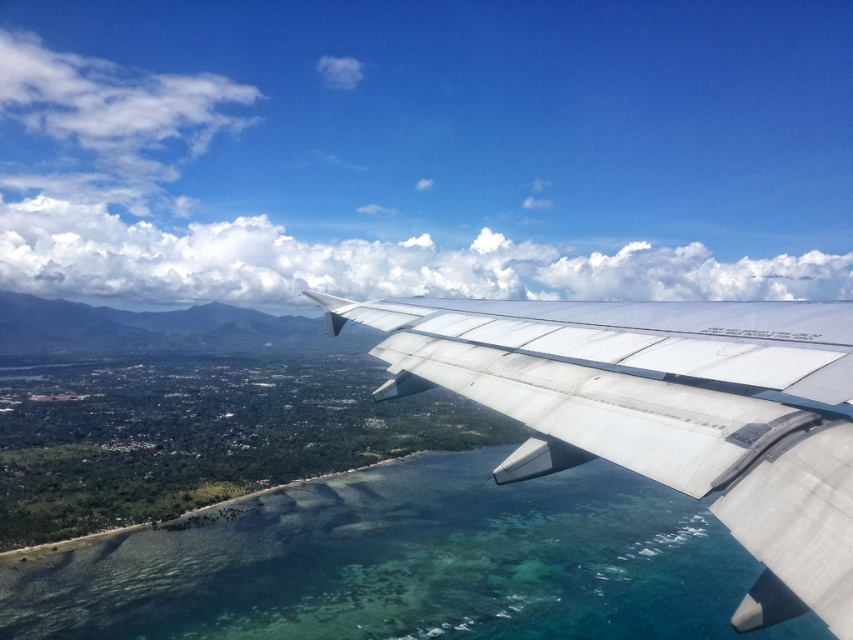
You are a pilot preparing for takeoff and need to ensure there are no obstacles between the silver metallic wing at center and the clear blue water at lower center. Given that the minimum safe distance for takeoff is 500 meters, is the current distance sufficient?

The distance between the silver metallic wing at center and the clear blue water at lower center is 551.03 meters, which exceeds the minimum safe distance of 500 meters. Therefore, the current distance is sufficient for takeoff.

You are a passenger on an airplane and looking out the window. You see the silver metallic wing at center and the clear blue water at lower center. Which object is closer to you?

The clear blue water at lower center is closer to you because the silver metallic wing at center is behind it.

Consider the image. You are a pilot preparing for landing and need to ensure the silver metallic wing at center doesn not obstruct your view of the clear blue water at lower center. Based on the scene, will the wing block the view of the water since the wing is wider than the water?

The clear blue water at lower center is wider than the silver metallic wing at center, so the wing will not block the view of the water.